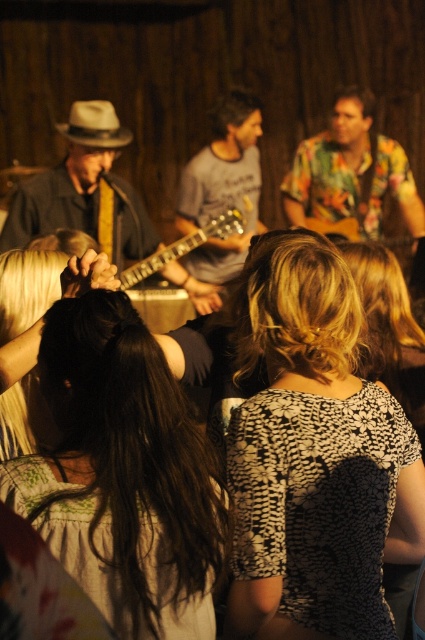
Question: Is black printed blouse at center smaller than white felt cowboy hat at upper left?

Choices:
 (A) yes
 (B) no

Answer: (B)

Question: From the image, what is the correct spatial relationship of black hair at center in relation to floral shirt at center?

Choices:
 (A) below
 (B) above

Answer: (A)

Question: Considering the real-world distances, which object is farthest from the black floral dress at center?

Choices:
 (A) gray t-shirt at center
 (B) floral shirt at center
 (C) black printed blouse at center
 (D) white felt cowboy hat at upper left

Answer: (B)

Question: Which point appears farthest from the camera in this image?

Choices:
 (A) (59, 328)
 (B) (354, 225)
 (C) (170, 257)

Answer: (B)

Question: Can you confirm if matte yellow shirt at left is positioned to the right of gray t-shirt at center?

Choices:
 (A) no
 (B) yes

Answer: (A)

Question: Which object is positioned closest to the shiny metallic guitar at center?

Choices:
 (A) black floral dress at center
 (B) black hair at center
 (C) matte yellow shirt at left

Answer: (C)